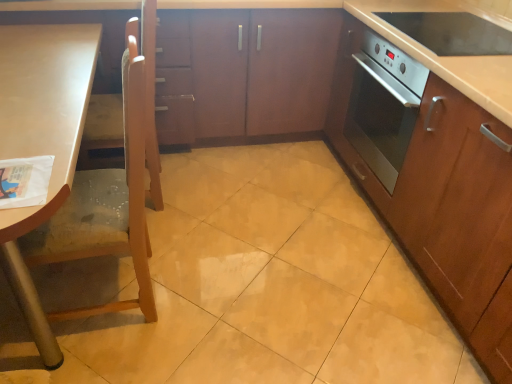
Where is `matte wood cabinetry at center, the 2th cabinetry viewed from the right`? The image size is (512, 384). matte wood cabinetry at center, the 2th cabinetry viewed from the right is located at coordinates (412, 41).

Does matte wood cabinetry at center, acting as the first cabinetry starting from the left, touch satin wood oven at right, which is counted as the second cabinetry, starting from the left?

No, matte wood cabinetry at center, acting as the first cabinetry starting from the left, is not next to satin wood oven at right, which is counted as the second cabinetry, starting from the left.

How much distance is there between matte wood cabinetry at center, acting as the first cabinetry starting from the left, and satin wood oven at right, the first cabinetry from the right?

11.71 inches.

From the picture: Is matte wood cabinetry at center, acting as the first cabinetry starting from the left, oriented away from satin wood oven at right, which is counted as the second cabinetry, starting from the left?

No, matte wood cabinetry at center, acting as the first cabinetry starting from the left,'s orientation is not away from satin wood oven at right, which is counted as the second cabinetry, starting from the left.

From a real-world perspective, is satin wood oven at right, the first cabinetry from the right, beneath metallic oven at right?

Yes, from a real-world perspective, satin wood oven at right, the first cabinetry from the right, is below metallic oven at right.

In the scene shown: Is satin wood oven at right, the first cabinetry from the right, behind metallic oven at right?

No, satin wood oven at right, the first cabinetry from the right, is closer to the camera.

Identify the location of kitchen appliance that appears above the satin wood oven at right, which is counted as the second cabinetry, starting from the left (from the image's perspective). The image size is (512, 384). (452, 32).

Is there a large distance between metallic oven at right and satin wood oven at right, which is counted as the second cabinetry, starting from the left?

No, there isn't a large distance between metallic oven at right and satin wood oven at right, which is counted as the second cabinetry, starting from the left.

Relative to satin wood oven at right, the first cabinetry from the right, is metallic oven at right in front or behind?

metallic oven at right is positioned farther from the viewer than satin wood oven at right, the first cabinetry from the right.

From the picture: Which point is more distant from viewer, (439, 54) or (429, 89)?

The point (439, 54) is farther from the camera.

Considering the relative sizes of metallic oven at right and satin wood oven at right, the first cabinetry from the right, in the image provided, is metallic oven at right thinner than satin wood oven at right, the first cabinetry from the right,?

Yes, metallic oven at right is thinner than satin wood oven at right, the first cabinetry from the right.

From a real-world perspective, is matte wood cabinetry at center, the 2th cabinetry viewed from the right, positioned under satin wood countertop at right based on gravity?

Yes.

Is matte wood cabinetry at center, the 2th cabinetry viewed from the right, situated inside satin wood countertop at right or outside?

matte wood cabinetry at center, the 2th cabinetry viewed from the right, cannot be found inside satin wood countertop at right.

From the image's perspective, is metallic oven at right above or below matte wood cabinetry at center, the 2th cabinetry viewed from the right?

From the image's perspective, metallic oven at right appears below matte wood cabinetry at center, the 2th cabinetry viewed from the right.

Are metallic oven at right and matte wood cabinetry at center, the 2th cabinetry viewed from the right, located far from each other?

No, metallic oven at right is not far away from matte wood cabinetry at center, the 2th cabinetry viewed from the right.

Based on the photo, from a real-world perspective, is metallic oven at right above or below matte wood cabinetry at center, acting as the first cabinetry starting from the left?

metallic oven at right is above matte wood cabinetry at center, acting as the first cabinetry starting from the left.

Which of these two, metallic oven at right or matte wood cabinetry at center, the 2th cabinetry viewed from the right, stands taller?

matte wood cabinetry at center, the 2th cabinetry viewed from the right, is taller.

From a real-world perspective, between satin wood oven at right, the first cabinetry from the right, and satin wood countertop at right, who is vertically higher?

From a 3D spatial view, satin wood countertop at right is above.

Can you confirm if satin wood oven at right, which is counted as the second cabinetry, starting from the left, is bigger than satin wood countertop at right?

Indeed, satin wood oven at right, which is counted as the second cabinetry, starting from the left, has a larger size compared to satin wood countertop at right.

Considering the relative sizes of satin wood oven at right, which is counted as the second cabinetry, starting from the left, and satin wood countertop at right in the image provided, is satin wood oven at right, which is counted as the second cabinetry, starting from the left, wider than satin wood countertop at right?

No, satin wood oven at right, which is counted as the second cabinetry, starting from the left, is not wider than satin wood countertop at right.

Considering the positions of objects satin wood oven at right, which is counted as the second cabinetry, starting from the left, and satin wood countertop at right in the image provided, who is more to the left, satin wood oven at right, which is counted as the second cabinetry, starting from the left, or satin wood countertop at right?

From the viewer's perspective, satin wood countertop at right appears more on the left side.

At what (x,y) coordinates should I click in order to perform the action: click on cabinetry lying on the left of satin wood oven at right, which is counted as the second cabinetry, starting from the left. Please return your answer as a coordinate pair (x, y). Looking at the image, I should click on click(x=412, y=41).

Could you tell me if satin wood oven at right, which is counted as the second cabinetry, starting from the left, is turned towards matte wood cabinetry at center, acting as the first cabinetry starting from the left?

Yes, satin wood oven at right, which is counted as the second cabinetry, starting from the left, is facing matte wood cabinetry at center, acting as the first cabinetry starting from the left.

Does satin wood oven at right, the first cabinetry from the right, have a lesser height compared to matte wood cabinetry at center, acting as the first cabinetry starting from the left?

No, satin wood oven at right, the first cabinetry from the right, is not shorter than matte wood cabinetry at center, acting as the first cabinetry starting from the left.

Locate an element on the screen. The width and height of the screenshot is (512, 384). cabinetry in front of the matte wood cabinetry at center, acting as the first cabinetry starting from the left is located at coordinates (449, 176).

Identify the location of kitchen appliance on the right side of satin wood oven at right, which is counted as the second cabinetry, starting from the left. (452, 32).

Considering their positions, is satin wood oven at right, the first cabinetry from the right, positioned further to light brown wood chair at left than matte wood cabinetry at center, acting as the first cabinetry starting from the left?

satin wood oven at right, the first cabinetry from the right, lies further to light brown wood chair at left than the other object.

Estimate the real-world distances between objects in this image. Which object is further from satin wood countertop at right, metallic oven at right or matte wood cabinetry at center, acting as the first cabinetry starting from the left?

matte wood cabinetry at center, acting as the first cabinetry starting from the left, is positioned further to the anchor satin wood countertop at right.

Looking at the image, which one is located further to metallic oven at right, light brown wood chair at left or satin wood oven at right, the first cabinetry from the right?

The object further to metallic oven at right is light brown wood chair at left.

Looking at the image, which one is located closer to metallic oven at right, satin wood countertop at right or satin wood oven at right, the first cabinetry from the right?

The object closer to metallic oven at right is satin wood countertop at right.

Looking at the image, which one is located closer to satin wood countertop at right, satin wood oven at right, the first cabinetry from the right, or light brown wood chair at left?

satin wood oven at right, the first cabinetry from the right.

When comparing their distances from satin wood oven at right, the first cabinetry from the right, does light brown wood chair at left or matte wood cabinetry at center, acting as the first cabinetry starting from the left, seem further?

light brown wood chair at left is positioned further to the anchor satin wood oven at right, the first cabinetry from the right.

Based on their spatial positions, is light brown wood chair at left or matte wood cabinetry at center, the 2th cabinetry viewed from the right, closer to metallic oven at right?

Among the two, matte wood cabinetry at center, the 2th cabinetry viewed from the right, is located nearer to metallic oven at right.

Which object lies nearer to the anchor point matte wood cabinetry at center, acting as the first cabinetry starting from the left, satin wood oven at right, which is counted as the second cabinetry, starting from the left, or metallic oven at right?

metallic oven at right is positioned closer to the anchor matte wood cabinetry at center, acting as the first cabinetry starting from the left.

Find the location of a particular element. This screenshot has height=384, width=512. cabinetry situated between matte wood cabinetry at center, the 2th cabinetry viewed from the right, and metallic oven at right from left to right is located at coordinates click(x=449, y=176).

The height and width of the screenshot is (384, 512). Identify the location of kitchen appliance located between satin wood oven at right, the first cabinetry from the right, and satin wood countertop at right in the depth direction. (452, 32).

This screenshot has height=384, width=512. Identify the location of counter top situated between matte wood cabinetry at center, the 2th cabinetry viewed from the right, and metallic oven at right from left to right. (448, 57).

Where is `counter top between light brown wood chair at left and metallic oven at right in the horizontal direction`? This screenshot has width=512, height=384. counter top between light brown wood chair at left and metallic oven at right in the horizontal direction is located at coordinates (448, 57).